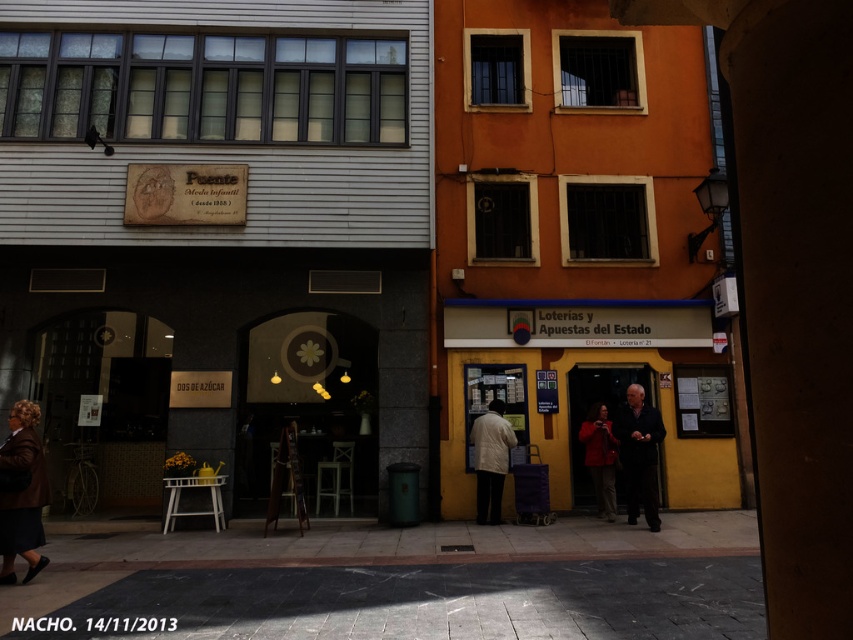
You are a customer at the store and see both the dark brown leather coat at lower left and the dark wool coat at center. Which coat is smaller in size?

The dark brown leather coat at lower left has a smaller size compared to the dark wool coat at center.

You are a tourist visiting this European town and want to take a photo of both the yellow matte building at center and the white matte jacket at center. Since you want both to be in the frame, which object should you focus on to ensure both are visible?

You should focus on the yellow matte building at center because it is bigger than the white matte jacket at center, so it will be easier to include both in the frame by centering on the larger object.